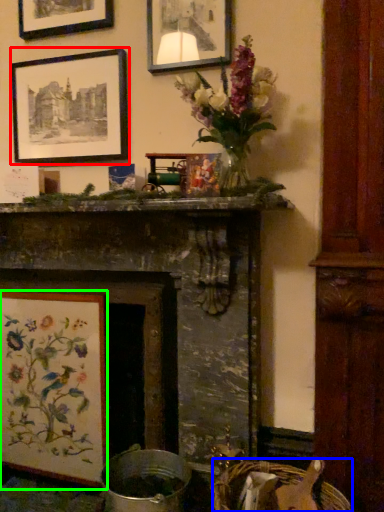
Question: Which object is positioned closest to picture frame (highlighted by a red box)? Select from basket (highlighted by a blue box) and picture frame (highlighted by a green box).

Choices:
 (A) basket
 (B) picture frame

Answer: (B)